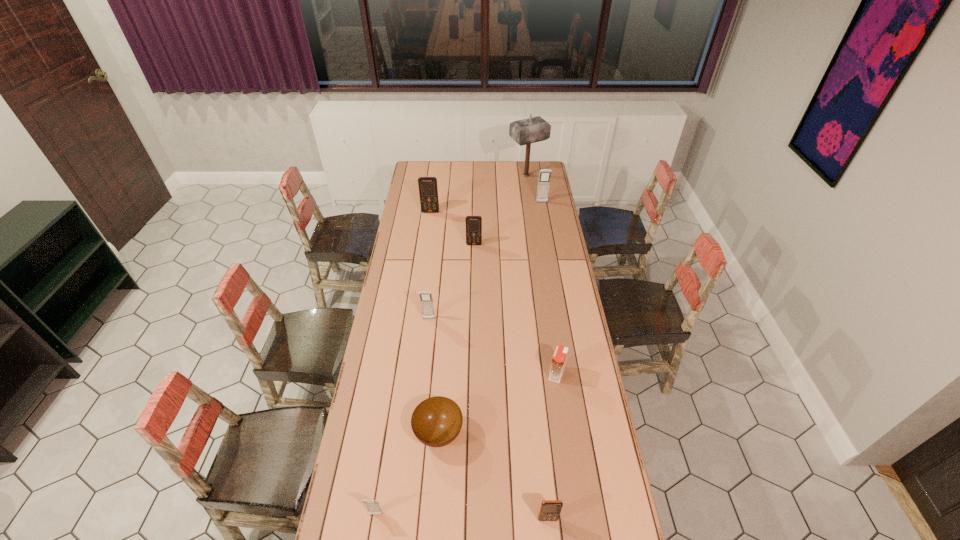
Locate an element on the screen. free space between the nearest orange cellular telephone and the orange orange juice is located at coordinates (552, 447).

This screenshot has width=960, height=540. Identify the location of empty location between the bowl and the nearest gray cellular telephone. (407, 474).

Find the location of a particular element. free space between the second farthest cellular telephone and the tallest object is located at coordinates (478, 194).

The image size is (960, 540). What are the coordinates of `vacant area between the leftmost gray cellular telephone and the orange orange juice` in the screenshot? It's located at (466, 444).

Identify which object is located as the fifth nearest to the fourth farthest object. Please provide its 2D coordinates. Your answer should be formatted as a tuple, i.e. [(x, y)], where the tuple contains the x and y coordinates of a point satisfying the conditions above.

[(559, 358)]

Locate an element on the screen. object identified as the seventh closest to the second gray cellular telephone from right to left is located at coordinates (545, 174).

Select which cellular telephone is the third closest to the rightmost gray cellular telephone. Please provide its 2D coordinates. Your answer should be formatted as a tuple, i.e. [(x, y)], where the tuple contains the x and y coordinates of a point satisfying the conditions above.

[(426, 299)]

At what (x,y) coordinates should I click in order to perform the action: click on cellular telephone identified as the second closest to the second smallest orange cellular telephone. Please return your answer as a coordinate pair (x, y). The width and height of the screenshot is (960, 540). Looking at the image, I should click on (545, 174).

Find the location of a particular element. the closest gray cellular telephone relative to the farthest object is located at coordinates (545, 174).

The image size is (960, 540). Identify the location of gray cellular telephone that is the second closest to the rightmost orange cellular telephone. (426, 299).